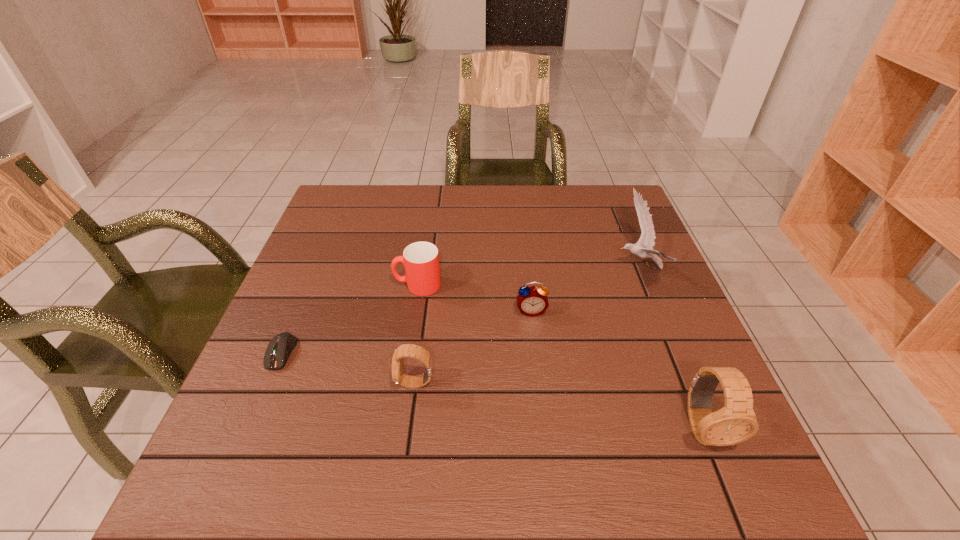
Where is `object that stands as the second closest to the cup`? This screenshot has height=540, width=960. object that stands as the second closest to the cup is located at coordinates (406, 350).

Point out which object is positioned as the fifth nearest to the computer equipment. Please provide its 2D coordinates. Your answer should be formatted as a tuple, i.e. [(x, y)], where the tuple contains the x and y coordinates of a point satisfying the conditions above.

[(736, 422)]